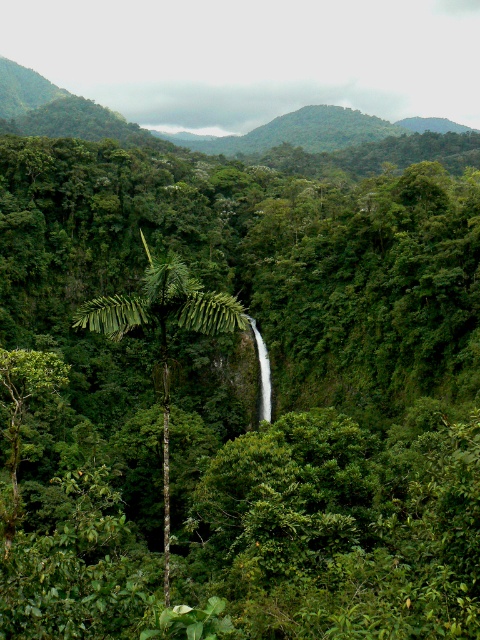
Question: Can you confirm if green leafy mountain at upper center is thinner than green leafy palm tree at center?

Choices:
 (A) no
 (B) yes

Answer: (A)

Question: Which point is closer to the camera taking this photo?

Choices:
 (A) (367, 129)
 (B) (182, 320)

Answer: (B)

Question: Is green leafy mountain at upper center further to camera compared to green leafy palm tree at center?

Choices:
 (A) yes
 (B) no

Answer: (A)

Question: Does green leafy mountain at upper center have a greater width compared to green leafy palm tree at center?

Choices:
 (A) yes
 (B) no

Answer: (A)

Question: Which point is farther to the camera?

Choices:
 (A) (113, 316)
 (B) (457, 129)

Answer: (B)